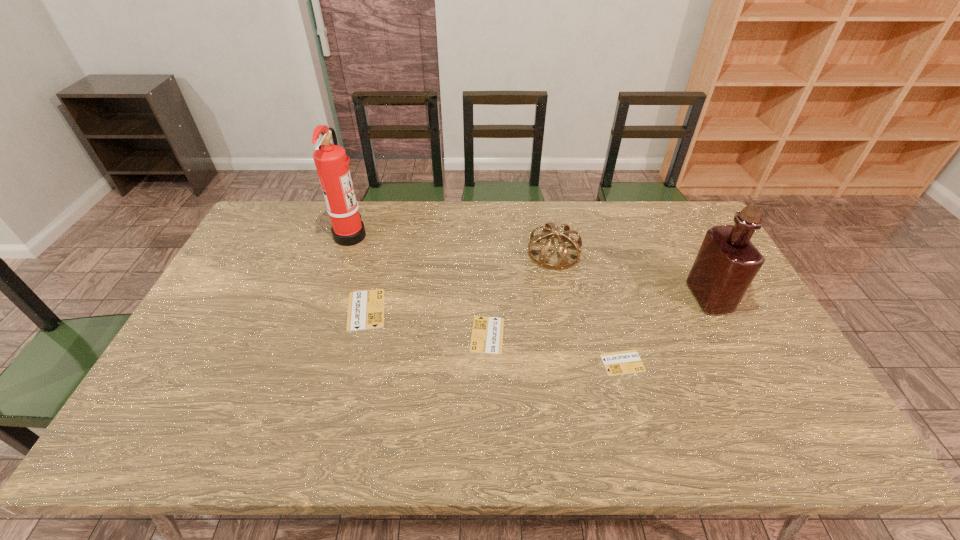
Identify the location of vacant space at the far edge of the desktop. The height and width of the screenshot is (540, 960). 424,234.

In the image, there is a desktop. Find the location of `blank space at the near edge`. blank space at the near edge is located at coordinates (297, 398).

Image resolution: width=960 pixels, height=540 pixels. Find the location of `vacant space at the left edge of the desktop`. vacant space at the left edge of the desktop is located at coordinates (212, 321).

Where is `vacant space at the right edge`? Image resolution: width=960 pixels, height=540 pixels. vacant space at the right edge is located at coordinates (737, 370).

You are a GUI agent. You are given a task and a screenshot of the screen. Output one action in this format:
    pyautogui.click(x=<x>, y=<y>)
    Task: Click on the vacant space at the far left corner of the desktop
    
    Given the screenshot: What is the action you would take?
    pyautogui.click(x=255, y=242)

Where is `vacant region at the near right corner of the desktop`? vacant region at the near right corner of the desktop is located at coordinates (775, 379).

Locate an element on the screen. This screenshot has height=540, width=960. free space between the rightmost object and the fire extinguisher is located at coordinates (530, 266).

Where is `free space between the fire extinguisher and the tallest identity card`? Image resolution: width=960 pixels, height=540 pixels. free space between the fire extinguisher and the tallest identity card is located at coordinates (358, 272).

The width and height of the screenshot is (960, 540). Find the location of `vacant region between the shortest object and the leftmost object`. vacant region between the shortest object and the leftmost object is located at coordinates (487, 299).

The width and height of the screenshot is (960, 540). In order to click on free area in between the fifth tallest object and the rightmost object in this screenshot , I will do `click(598, 316)`.